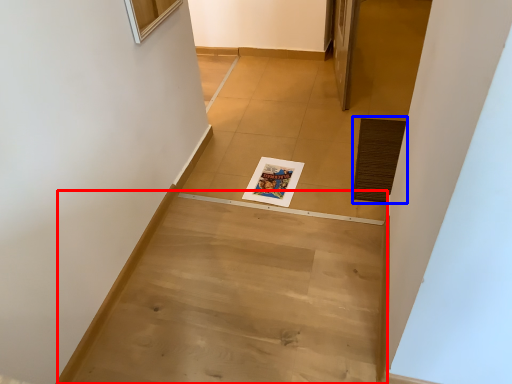
Question: Which point is further to the camera, stairwell (highlighted by a red box) or doormat (highlighted by a blue box)?

Choices:
 (A) stairwell
 (B) doormat

Answer: (B)